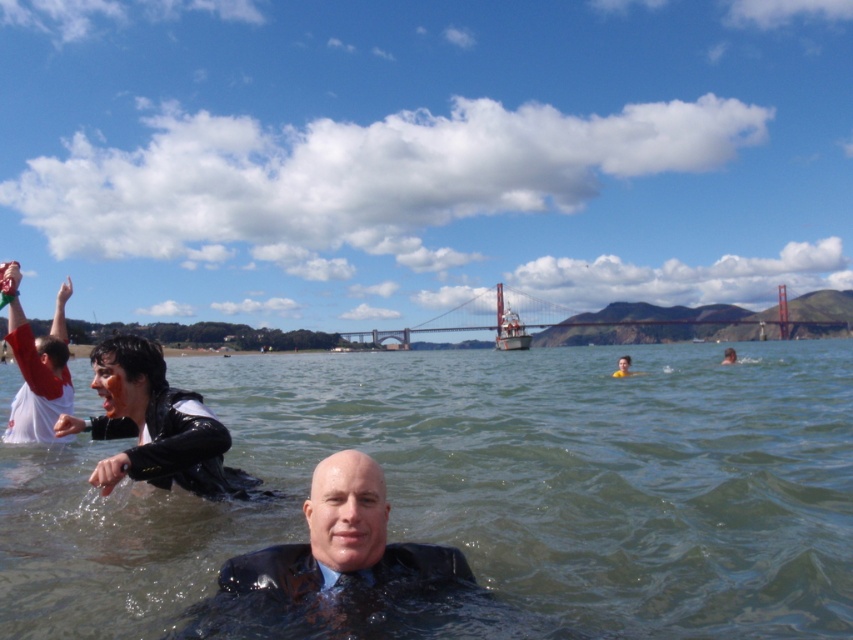
From the picture: Which is more to the left, black matte suit at center or smooth skin face at center?

Positioned to the left is black matte suit at center.

Does black matte suit at center have a larger size compared to smooth skin face at center?

No.

Which is behind, point (393, 596) or point (619, 362)?

Point (619, 362)

Locate an element on the screen. Image resolution: width=853 pixels, height=640 pixels. black matte suit at center is located at coordinates (334, 564).

Who is more distant from viewer, (x=373, y=554) or (x=210, y=497)?

The point (x=210, y=497) is behind.

Image resolution: width=853 pixels, height=640 pixels. I want to click on black matte suit at center, so click(334, 564).

Is point (335, 586) more distant than point (218, 438)?

No, (335, 586) is in front of (218, 438).

Locate an element on the screen. This screenshot has width=853, height=640. black matte suit at center is located at coordinates (334, 564).

The image size is (853, 640). Describe the element at coordinates (485, 490) in the screenshot. I see `clear water at center` at that location.

Is clear water at center to the left of metallic bridge at center from the viewer's perspective?

Correct, you'll find clear water at center to the left of metallic bridge at center.

Find the location of a particular element. The height and width of the screenshot is (640, 853). clear water at center is located at coordinates (485, 490).